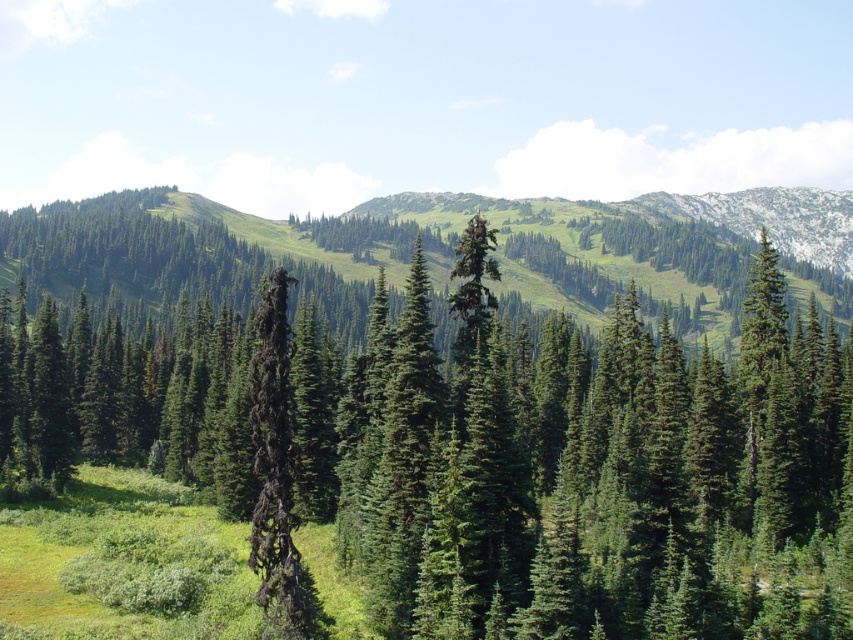
You are standing at the point marked as point (482, 452) in the image. Looking around, you see a green matte tree at center. Can you determine which direction the green matte tree at center is located relative to your position?

The green matte tree at center is located at your current position since the point corresponds to it.